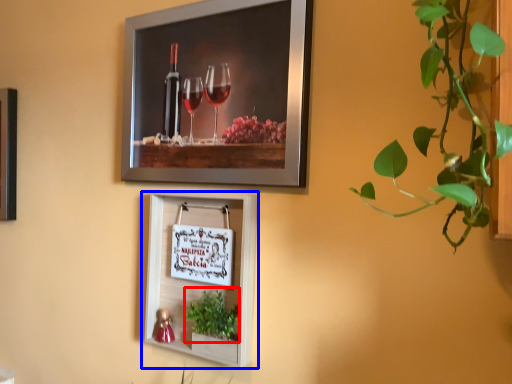
Question: Which object is further to the camera taking this photo, plant (highlighted by a red box) or picture frame (highlighted by a blue box)?

Choices:
 (A) plant
 (B) picture frame

Answer: (B)